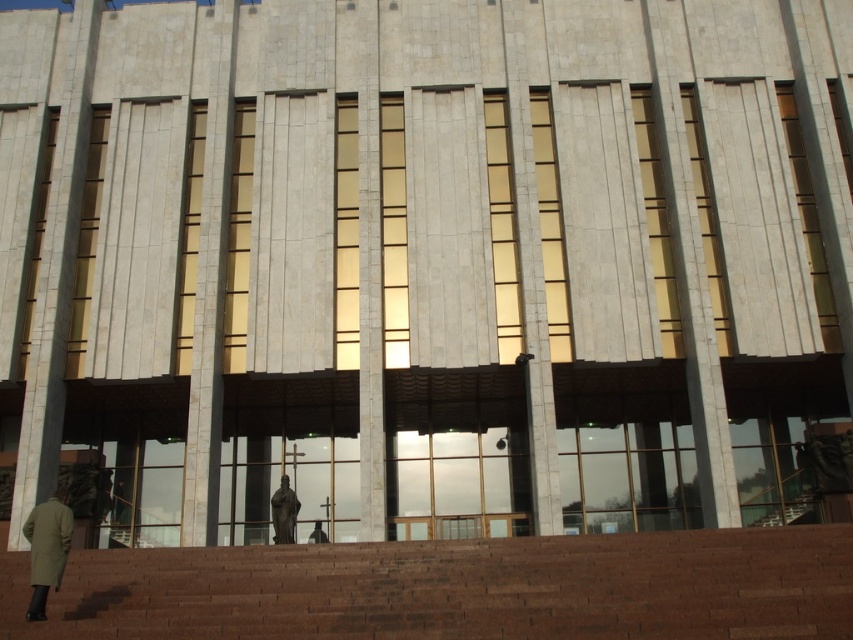
Is dark olive-green fabric trench coat at lower left below dark gray fabric person at center?

Actually, dark olive-green fabric trench coat at lower left is above dark gray fabric person at center.

Does dark olive-green fabric trench coat at lower left have a greater height compared to dark gray fabric person at center?

Correct, dark olive-green fabric trench coat at lower left is much taller as dark gray fabric person at center.

Does point (62, 508) lie behind point (311, 538)?

That is False.

Find the location of a particular element. This screenshot has height=640, width=853. dark olive-green fabric trench coat at lower left is located at coordinates (48, 541).

Is brown brick stairs at lower left further to the viewer compared to dark gray fabric person at center?

No, it is in front of dark gray fabric person at center.

Is brown brick stairs at lower left smaller than dark gray fabric person at center?

No.

Which is in front, point (666, 632) or point (314, 529)?

Point (666, 632)

Locate an element on the screen. Image resolution: width=853 pixels, height=640 pixels. brown brick stairs at lower left is located at coordinates (457, 589).

Is brown brick stairs at lower left shorter than dark olive-green fabric trench coat at lower left?

Yes.

Between brown brick stairs at lower left and dark olive-green fabric trench coat at lower left, which one has more height?

Standing taller between the two is dark olive-green fabric trench coat at lower left.

Is point (90, 552) positioned behind point (70, 516)?

That is True.

Identify the location of brown brick stairs at lower left. The image size is (853, 640). (457, 589).